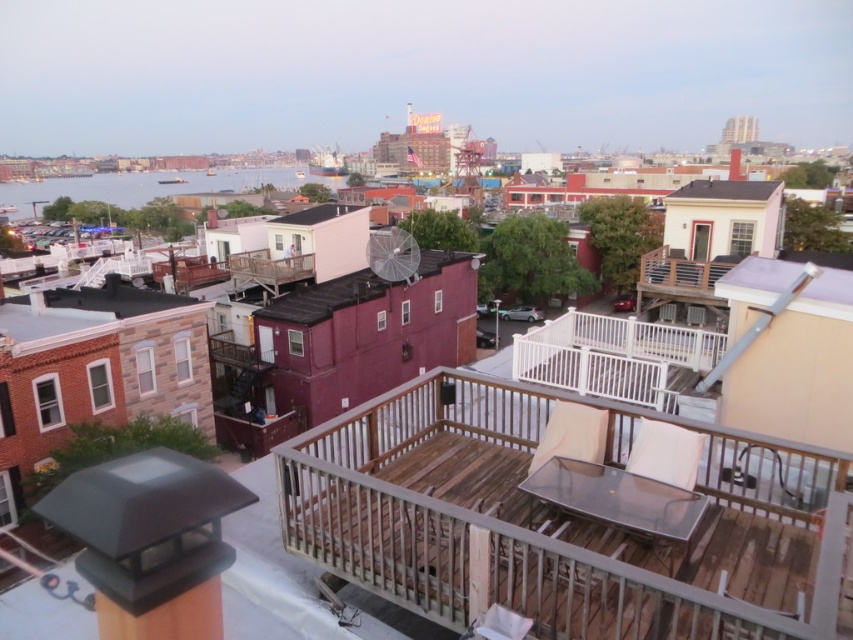
Question: In this image, where is brown wooden deck at center located relative to blue water at left?

Choices:
 (A) below
 (B) above

Answer: (A)

Question: Among these objects, which one is nearest to the camera?

Choices:
 (A) white wood balcony at center
 (B) brown wooden deck at center

Answer: (B)

Question: Considering the real-world distances, which object is farthest from the brown wooden deck at center?

Choices:
 (A) white wood balcony at center
 (B) blue water at left

Answer: (B)

Question: Among these objects, which one is farthest from the camera?

Choices:
 (A) brown wooden deck at center
 (B) white wood balcony at center

Answer: (B)

Question: Where is brown wooden deck at center located in relation to blue water at left in the image?

Choices:
 (A) left
 (B) right

Answer: (B)

Question: From the image, what is the correct spatial relationship of white wood balcony at center in relation to blue water at left?

Choices:
 (A) below
 (B) above

Answer: (A)